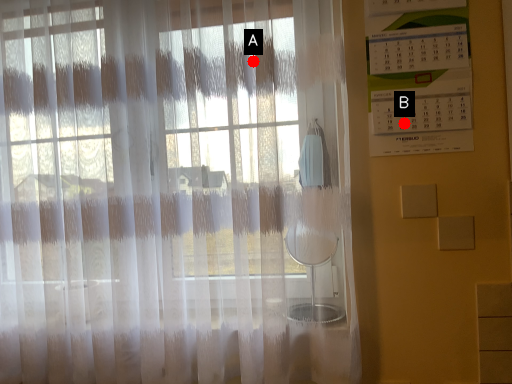
Question: Two points are circled on the image, labeled by A and B beside each circle. Which of the following is the farthest from the observer?

Choices:
 (A) A is further
 (B) B is further

Answer: (B)